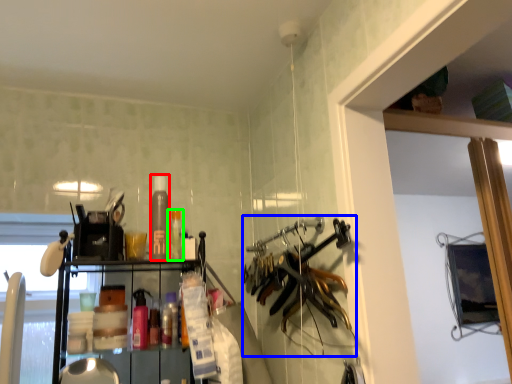
Question: Considering the real-world distances, which object is closest to bottle (highlighted by a red box)? hanger (highlighted by a blue box) or bottle (highlighted by a green box).

Choices:
 (A) hanger
 (B) bottle

Answer: (B)